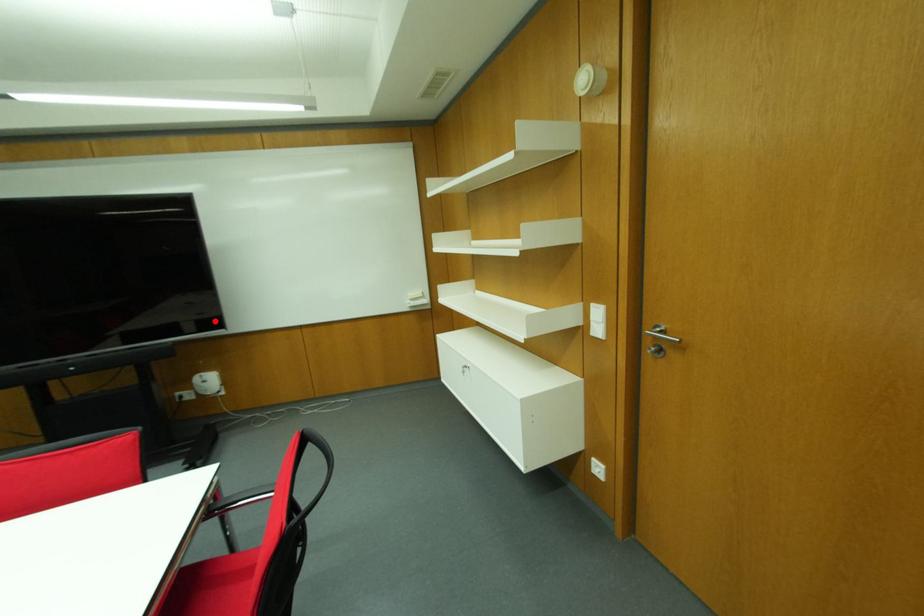
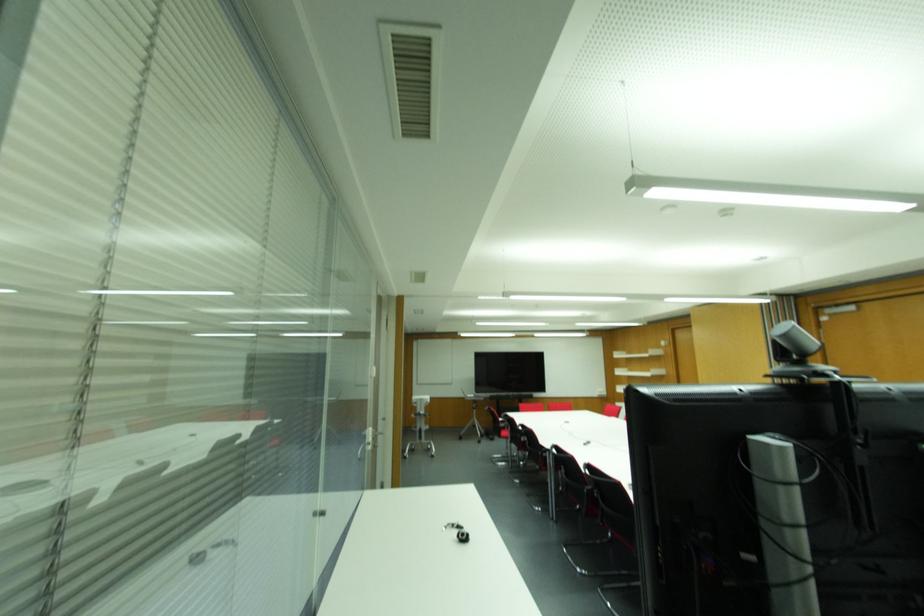
Question: I am providing you with two images of the same scene from different viewpoints. A red point is marked on the first image. At the location where the point appears in image 1, is it still visible in image 2?

Choices:
 (A) Yes
 (B) No

Answer: (A)